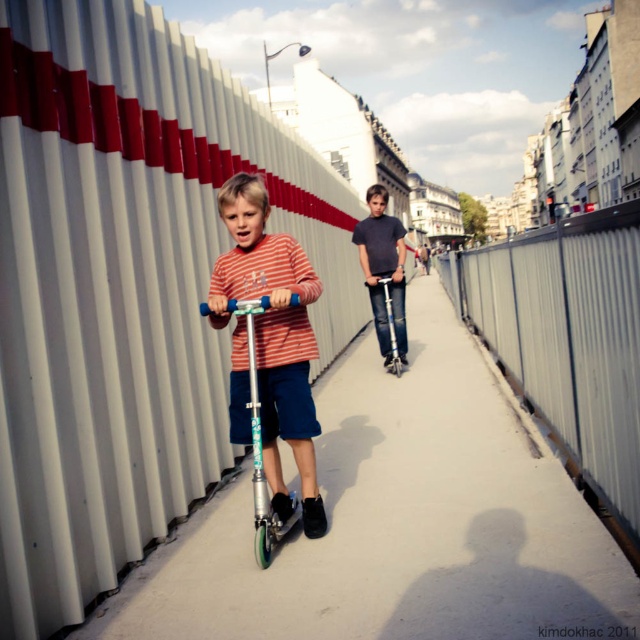
Can you confirm if matte gray pavement at center is positioned to the left of metallic silver fence at right?

Yes, matte gray pavement at center is to the left of metallic silver fence at right.

Is matte gray pavement at center shorter than metallic silver fence at right?

Indeed, matte gray pavement at center has a lesser height compared to metallic silver fence at right.

The width and height of the screenshot is (640, 640). I want to click on matte gray pavement at center, so point(397,520).

Find the location of a particular element. This screenshot has height=640, width=640. matte gray pavement at center is located at coordinates (397, 520).

Can you confirm if matte gray pavement at center is bigger than striped cotton shirt at center?

Correct, matte gray pavement at center is larger in size than striped cotton shirt at center.

Where is `matte gray pavement at center`? This screenshot has height=640, width=640. matte gray pavement at center is located at coordinates (397, 520).

Does striped cotton shirt at center have a lesser width compared to teal glossy scooter at center?

No, striped cotton shirt at center is not thinner than teal glossy scooter at center.

Does striped cotton shirt at center have a greater height compared to teal glossy scooter at center?

Correct, striped cotton shirt at center is much taller as teal glossy scooter at center.

This screenshot has width=640, height=640. What are the coordinates of `striped cotton shirt at center` in the screenshot? It's located at (x=273, y=337).

Identify the location of striped cotton shirt at center. (273, 337).